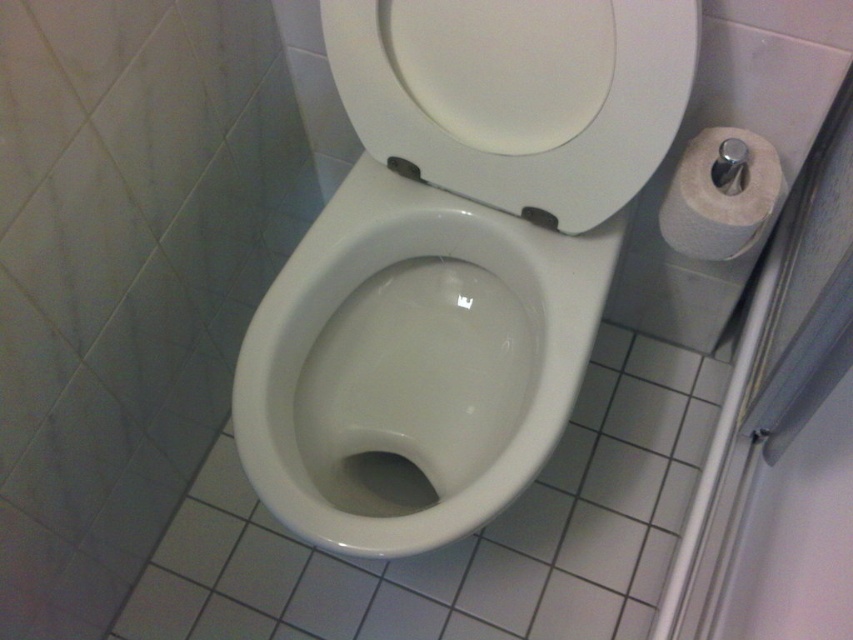
You are standing in the bathroom and want to locate the white glossy toilet at center. Which direction should you move relative to your current position at point (454, 257)?

You are already at the white glossy toilet at center, so no movement is needed.